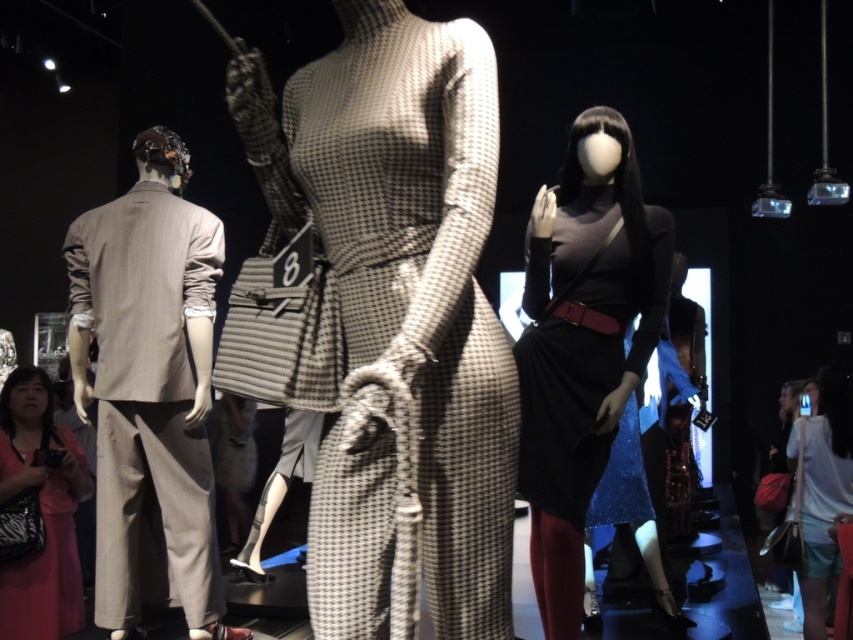
Question: Where is houndstooth fabric dress at center located in relation to matte black dress at center in the image?

Choices:
 (A) below
 (B) above

Answer: (B)

Question: Does houndstooth fabric dress at center have a larger size compared to pink fabric dress at lower left?

Choices:
 (A) yes
 (B) no

Answer: (B)

Question: Estimate the real-world distances between objects in this image. Which object is closer to the houndstooth fabric dress at center?

Choices:
 (A) matte black dress at center
 (B) pink fabric dress at lower left

Answer: (A)

Question: Which object appears closest to the camera in this image?

Choices:
 (A) matte black dress at center
 (B) houndstooth fabric dress at center
 (C) pink fabric dress at lower left

Answer: (B)

Question: Does houndstooth fabric dress at center come in front of matte black dress at center?

Choices:
 (A) no
 (B) yes

Answer: (B)

Question: Which point is closer to the camera?

Choices:
 (A) houndstooth fabric dress at center
 (B) pink fabric dress at lower left
 (C) matte black dress at center

Answer: (A)